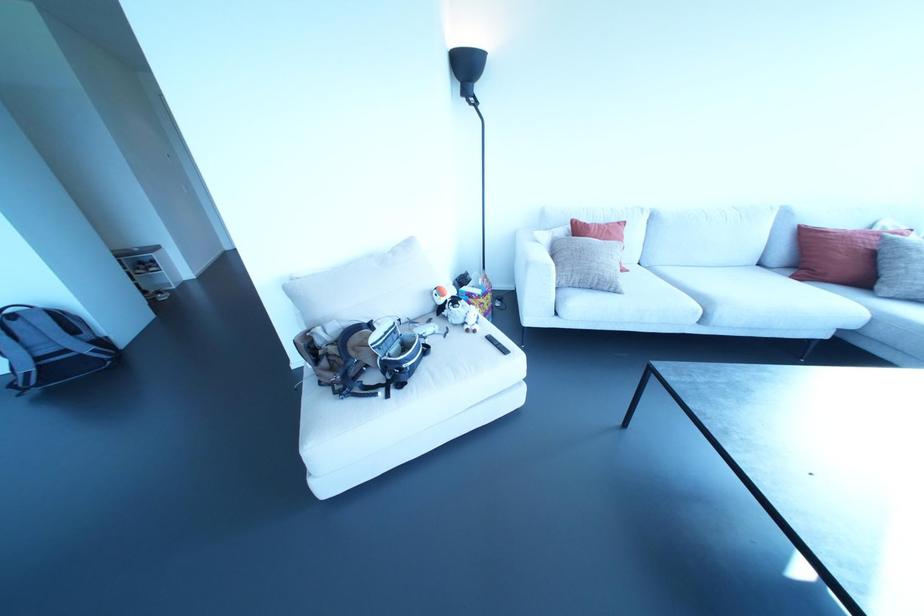
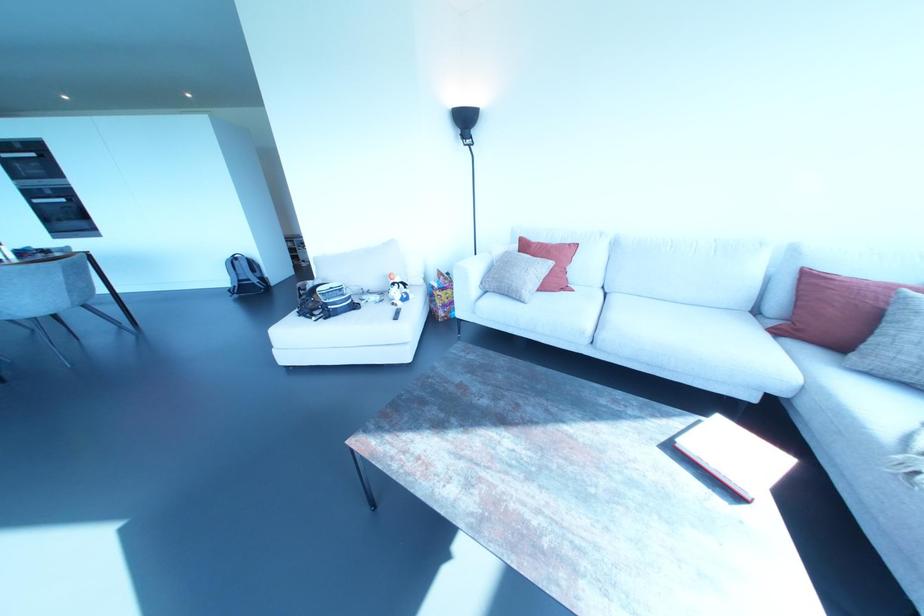
Question: Which direction would the cameraman need to move to produce the second image? Reply with the corresponding letter.

Choices:
 (A) Left
 (B) Right
 (C) Forward
 (D) Backward

Answer: (B)